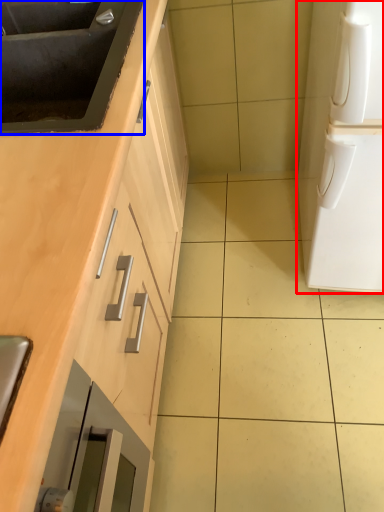
Question: Which point is closer to the camera, home appliance (highlighted by a red box) or sink (highlighted by a blue box)?

Choices:
 (A) home appliance
 (B) sink

Answer: (A)